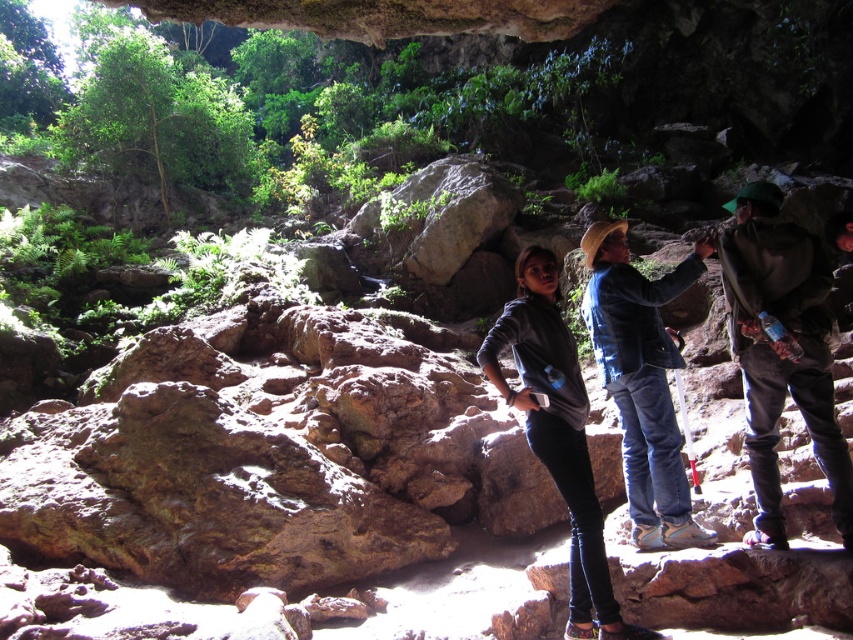
Does point (660, 452) lie behind point (583, 387)?

Yes, it is.

Does blue denim jeans at center have a greater width compared to gray matte jacket at center?

Yes.

At what (x,y) coordinates should I click in order to perform the action: click on blue denim jeans at center. Please return your answer as a coordinate pair (x, y). Looking at the image, I should click on (642, 380).

Who is more forward, (804, 230) or (665, 392)?

Point (804, 230) is in front.

Does point (746, 422) come farther from viewer compared to point (596, 348)?

No.

Find the location of a particular element. The width and height of the screenshot is (853, 640). dark brown leather jacket at right is located at coordinates (781, 352).

Can you confirm if dark blue jeans at center is wider than dark brown leather jacket at right?

Yes.

Does dark blue jeans at center appear on the right side of dark brown leather jacket at right?

Incorrect, dark blue jeans at center is not on the right side of dark brown leather jacket at right.

Does point (747, 227) come behind point (769, 314)?

That is True.

The image size is (853, 640). In order to click on dark blue jeans at center in this screenshot , I will do `click(780, 348)`.